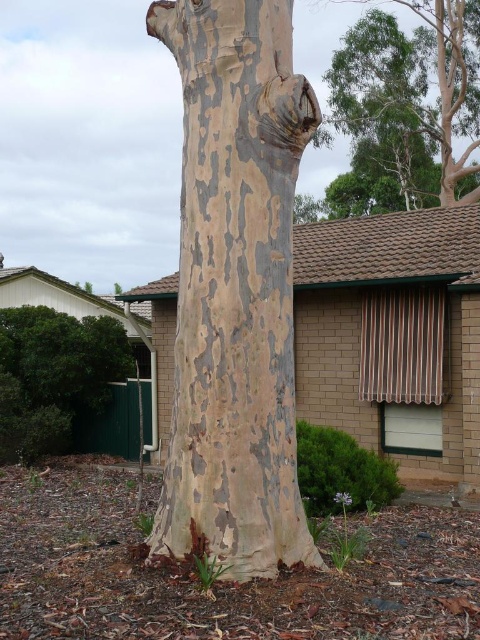
Can you confirm if speckled bark tree trunk at center is smaller than smooth bark tree at upper right?

Yes.

Can you confirm if speckled bark tree trunk at center is wider than smooth bark tree at upper right?

In fact, speckled bark tree trunk at center might be narrower than smooth bark tree at upper right.

Is point (195, 80) less distant than point (454, 122)?

Yes, it is.

Locate an element on the screen. This screenshot has height=640, width=480. speckled bark tree trunk at center is located at coordinates point(235,288).

Is point (371, 54) positioned before point (85, 404)?

No, it is behind (85, 404).

Is smooth bark tree at upper right wider than green leafy bush at lower left?

Indeed, smooth bark tree at upper right has a greater width compared to green leafy bush at lower left.

Consider the image. Measure the distance between smooth bark tree at upper right and camera.

smooth bark tree at upper right is 22.69 meters from camera.

Find the location of a particular element. smooth bark tree at upper right is located at coordinates (408, 108).

Is speckled bark tree trunk at center below green leafy bush at lower left?

Actually, speckled bark tree trunk at center is above green leafy bush at lower left.

Does speckled bark tree trunk at center appear on the left side of green leafy bush at lower left?

No, speckled bark tree trunk at center is not to the left of green leafy bush at lower left.

At what (x,y) coordinates should I click in order to perform the action: click on speckled bark tree trunk at center. Please return your answer as a coordinate pair (x, y). Looking at the image, I should click on (235, 288).